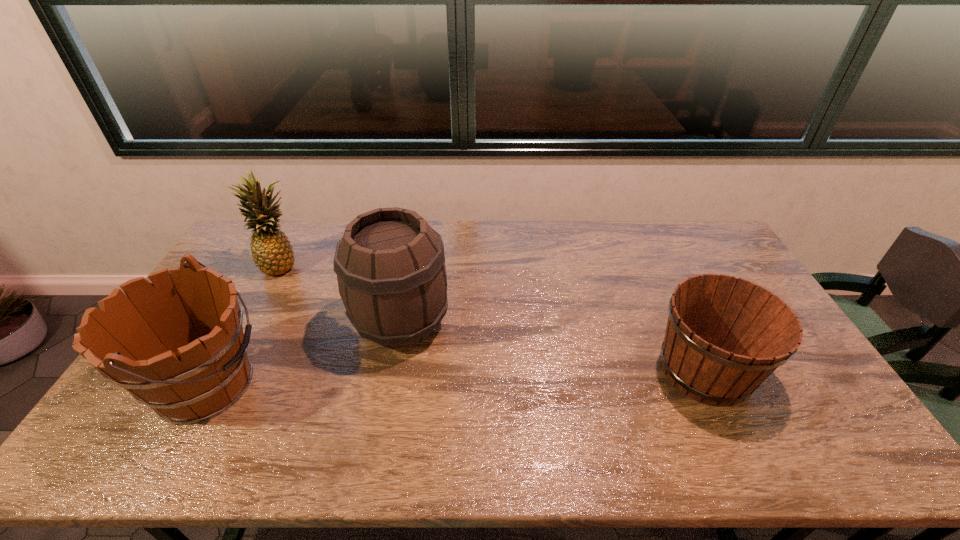
You are a GUI agent. You are given a task and a screenshot of the screen. Output one action in this format:
    pyautogui.click(x=<x>, y=<y>)
    Task: Click on the pineapple
    The height and width of the screenshot is (540, 960).
    Given the screenshot: What is the action you would take?
    pyautogui.click(x=272, y=253)

Identify the location of the second wine bucket from left to right. Image resolution: width=960 pixels, height=540 pixels. (390, 264).

You are a GUI agent. You are given a task and a screenshot of the screen. Output one action in this format:
    pyautogui.click(x=<x>, y=<y>)
    Task: Click on the leftmost wine bucket
    
    Given the screenshot: What is the action you would take?
    pyautogui.click(x=177, y=345)

Where is `the shortest object`? the shortest object is located at coordinates (725, 335).

This screenshot has width=960, height=540. Find the location of `the rightmost wine bucket`. the rightmost wine bucket is located at coordinates (725, 335).

This screenshot has width=960, height=540. In order to click on free space located 0.350m on the right of the pineapple in this screenshot , I will do `click(401, 266)`.

Locate an element on the screen. The height and width of the screenshot is (540, 960). free space located on the front of the second object from right to left is located at coordinates (384, 415).

The image size is (960, 540). Identify the location of vacant region located with the handle on the leftmost wine bucket. (349, 386).

You are a GUI agent. You are given a task and a screenshot of the screen. Output one action in this format:
    pyautogui.click(x=<x>, y=<y>)
    Task: Click on the free spot located on the back of the rightmost object
    The width and height of the screenshot is (960, 540).
    Given the screenshot: What is the action you would take?
    pyautogui.click(x=665, y=286)

The width and height of the screenshot is (960, 540). Identify the location of object that is at the far edge. (272, 253).